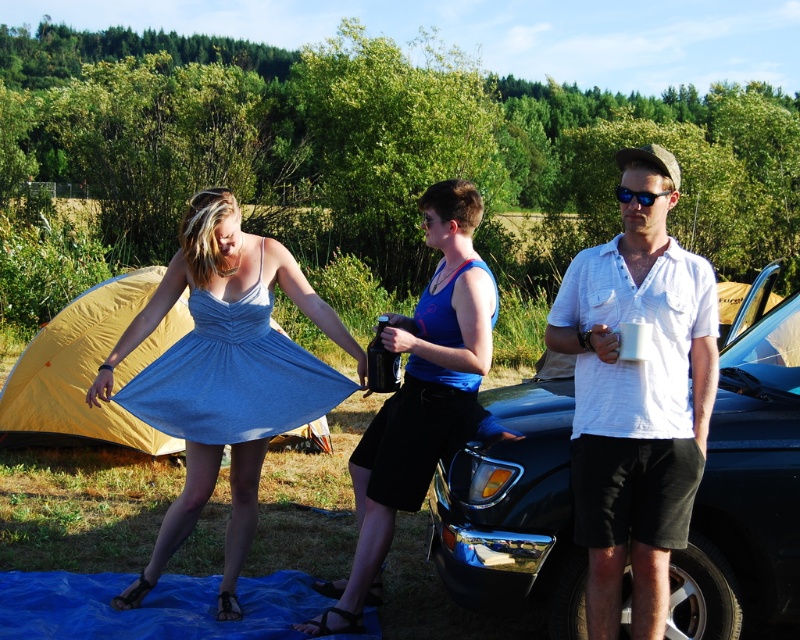
Looking at this image, between shiny blue car at center and blue fabric dress at center, which one is positioned lower?

shiny blue car at center is below.

How distant is shiny blue car at center from blue fabric dress at center?

shiny blue car at center and blue fabric dress at center are 32.60 inches apart from each other.

At what (x,y) coordinates should I click in order to perform the action: click on shiny blue car at center. Please return your answer as a coordinate pair (x, y). The image size is (800, 640). Looking at the image, I should click on (x=746, y=490).

Locate an element on the screen. The image size is (800, 640). matte blue dress at center is located at coordinates (224, 376).

Does matte blue dress at center come in front of blue tarp at lower center?

No, matte blue dress at center is further to the viewer.

Does point (224, 188) lie in front of point (68, 572)?

No, (224, 188) is behind (68, 572).

Find the location of a particular element. The width and height of the screenshot is (800, 640). matte blue dress at center is located at coordinates (224, 376).

Who is more forward, (545, 529) or (184, 500)?

Point (545, 529) is more forward.

Find the location of `shiny blue car at center`. shiny blue car at center is located at coordinates (746, 490).